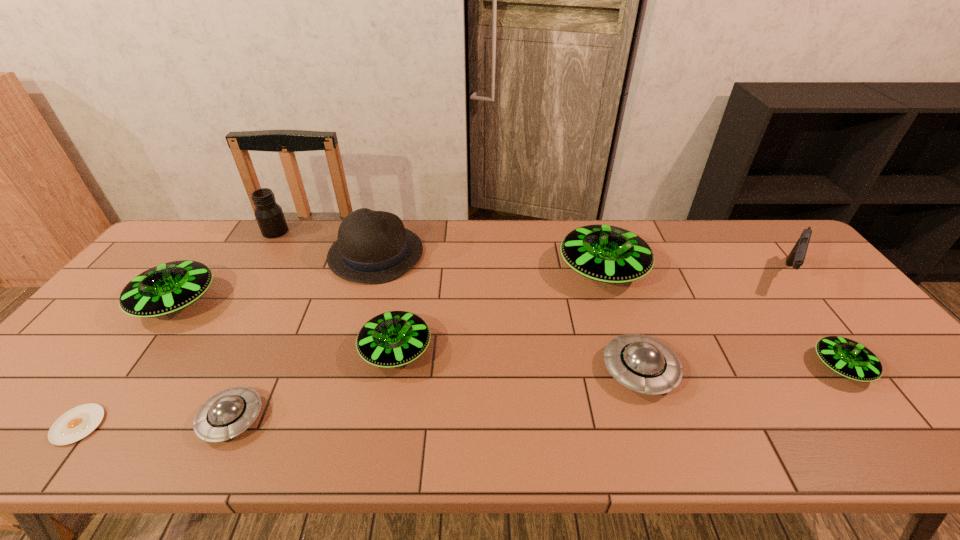
Where is `vacant space located on the back of the leftmost green saucer`? vacant space located on the back of the leftmost green saucer is located at coordinates (225, 237).

Where is `free spot located on the left of the third biggest green saucer`? The width and height of the screenshot is (960, 540). free spot located on the left of the third biggest green saucer is located at coordinates (317, 350).

Find the location of a particular element. Image resolution: width=960 pixels, height=540 pixels. vacant space situated 0.170m on the back of the right gray saucer is located at coordinates (614, 296).

The width and height of the screenshot is (960, 540). Identify the location of vacant position located on the left of the smallest green saucer. (682, 367).

At what (x,y) coordinates should I click in order to perform the action: click on vacant space located 0.140m on the left of the fifth saucer from right to left. Please return your answer as a coordinate pair (x, y). The width and height of the screenshot is (960, 540). Looking at the image, I should click on (137, 418).

Image resolution: width=960 pixels, height=540 pixels. I want to click on free space located 0.060m on the back of the shortest object, so click(110, 383).

The width and height of the screenshot is (960, 540). Find the location of `jar that is at the far edge`. jar that is at the far edge is located at coordinates (269, 215).

The width and height of the screenshot is (960, 540). Identify the location of bowler hat that is positioned at the far edge. (373, 247).

At what (x,y) coordinates should I click in order to perform the action: click on saucer positioned at the far edge. Please return your answer as a coordinate pair (x, y). The image size is (960, 540). Looking at the image, I should click on (609, 254).

This screenshot has width=960, height=540. I want to click on gun that is at the far edge, so click(796, 257).